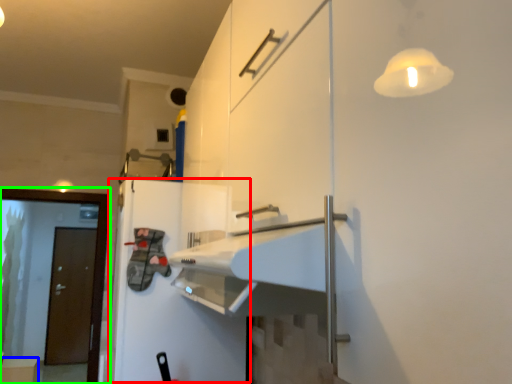
Question: Considering the real-world distances, which object is farthest from wide (highlighted by a red box)? cabinetry (highlighted by a blue box) or screen door (highlighted by a green box)?

Choices:
 (A) cabinetry
 (B) screen door

Answer: (A)